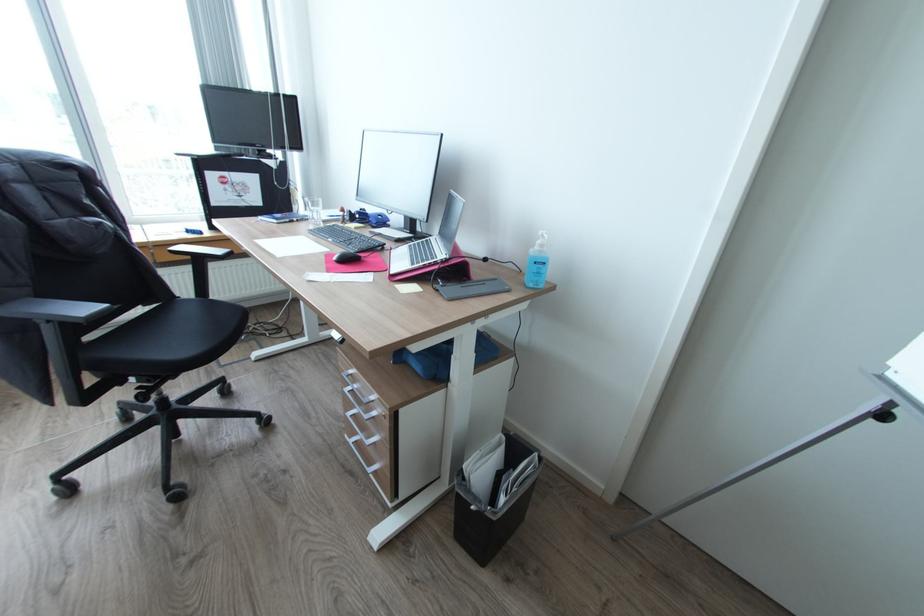
The height and width of the screenshot is (616, 924). Find the location of `blue sanitizer bottle`. blue sanitizer bottle is located at coordinates click(537, 262).